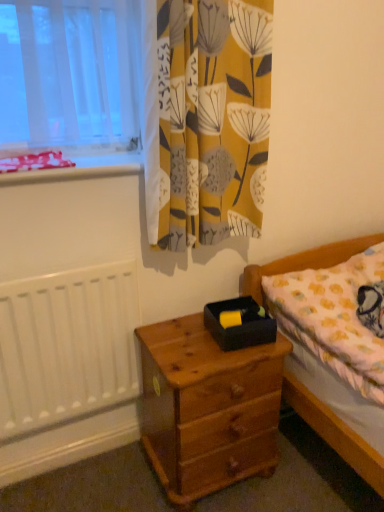
This screenshot has width=384, height=512. What are the coordinates of `spots to the right of wooden nightstand at lower center` in the screenshot? It's located at (303, 472).